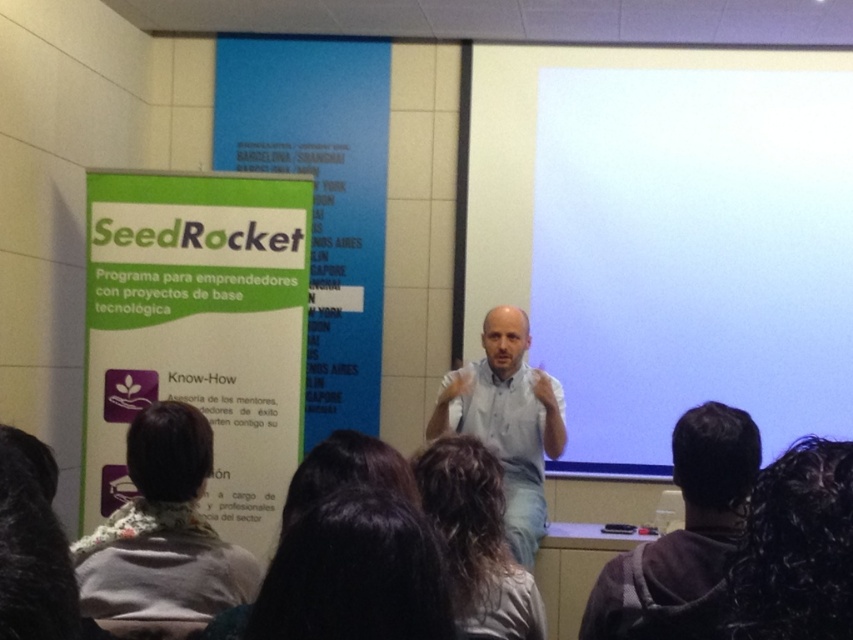
Who is higher up, white matte projection screen at upper center or dark curly hair at lower right?

white matte projection screen at upper center is above.

Is the position of white matte projection screen at upper center more distant than that of dark curly hair at lower right?

Yes, it is.

This screenshot has height=640, width=853. I want to click on white matte projection screen at upper center, so click(666, 236).

Can you confirm if white matte projection screen at upper center is shorter than dark hair at lower center?

In fact, white matte projection screen at upper center may be taller than dark hair at lower center.

Can you confirm if white matte projection screen at upper center is wider than dark hair at lower center?

Yes.

Does point (612, 208) lie in front of point (378, 616)?

No, it is not.

Identify the location of white matte projection screen at upper center. (666, 236).

Is point (850, 570) in front of point (709, 621)?

Yes, point (850, 570) is in front of point (709, 621).

From the picture: Between dark curly hair at lower right and dark gray hoodie at lower right, which one is positioned higher?

Positioned higher is dark curly hair at lower right.

Which is behind, point (821, 589) or point (612, 563)?

The point (612, 563) is more distant.

I want to click on dark curly hair at lower right, so click(796, 548).